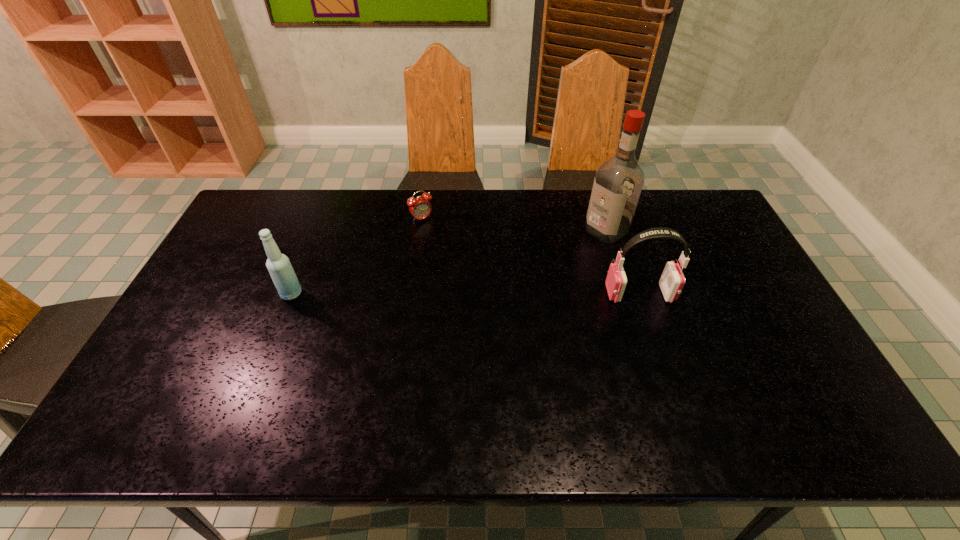
Identify the location of free spot on the desktop that is between the leftmost object and the earphone and is positioned on the front-facing side of the tallest object. (506, 294).

At what (x,y) coordinates should I click in order to perform the action: click on vacant space on the desktop that is between the bottle and the earphone and is positioned on the face of the shortest object. Please return your answer as a coordinate pair (x, y). Image resolution: width=960 pixels, height=540 pixels. Looking at the image, I should click on (483, 294).